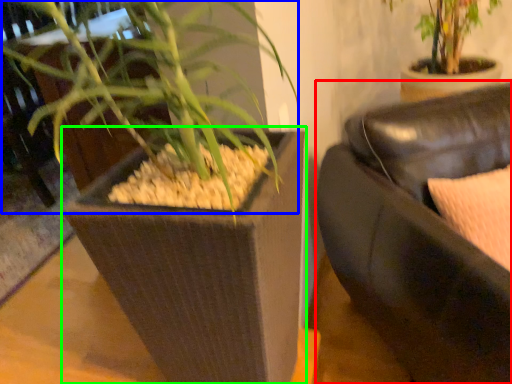
Question: Estimate the real-world distances between objects in this image. Which object is farther from studio couch (highlighted by a red box), orchid (highlighted by a blue box) or flowerpot (highlighted by a green box)?

Choices:
 (A) orchid
 (B) flowerpot

Answer: (A)